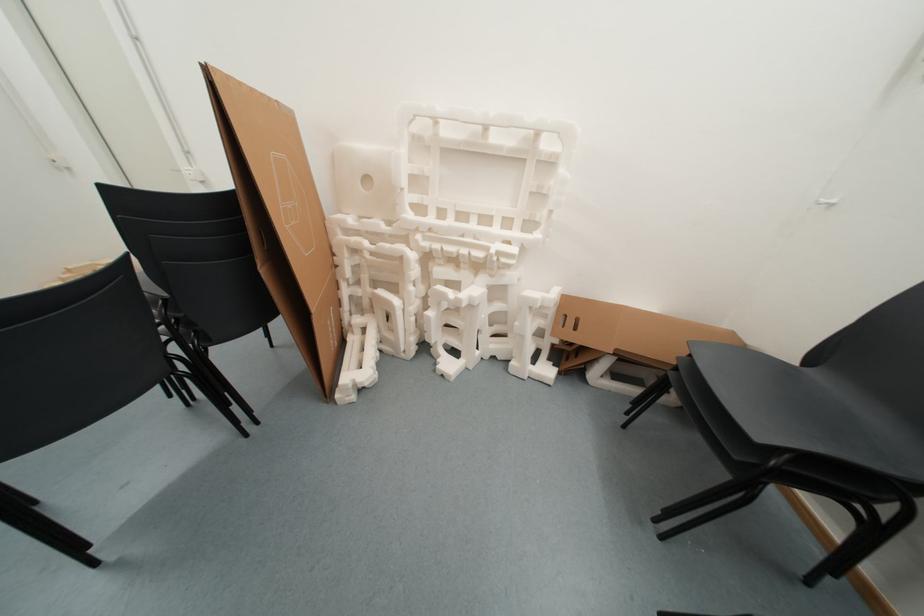
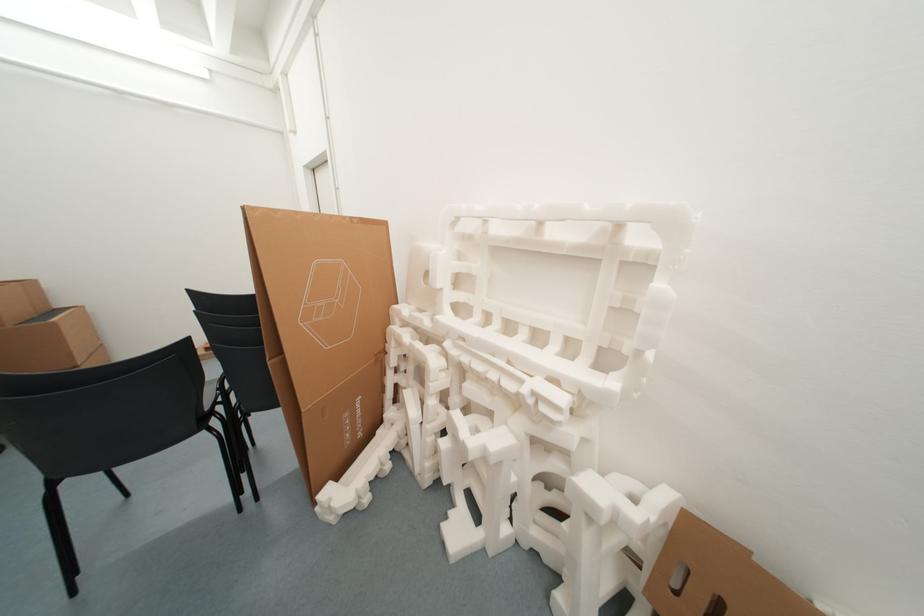
Question: How did the camera likely rotate?

Choices:
 (A) Left
 (B) Right
 (C) Up
 (D) Down

Answer: (A)